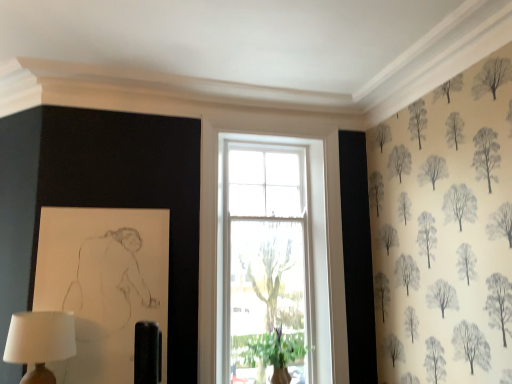
Question: From a real-world perspective, is matte white lampshade at lower left on green leafy plant at window?

Choices:
 (A) yes
 (B) no

Answer: (A)

Question: Is matte white lampshade at lower left smaller than green leafy plant at window?

Choices:
 (A) yes
 (B) no

Answer: (A)

Question: Is matte white lampshade at lower left positioned far away from green leafy plant at window?

Choices:
 (A) yes
 (B) no

Answer: (A)

Question: Is matte white lampshade at lower left further to the viewer compared to green leafy plant at window?

Choices:
 (A) yes
 (B) no

Answer: (B)

Question: Is matte white lampshade at lower left looking in the opposite direction of green leafy plant at window?

Choices:
 (A) yes
 (B) no

Answer: (B)

Question: Is matte white lampshade at lower left shorter than green leafy plant at window?

Choices:
 (A) yes
 (B) no

Answer: (A)

Question: Is green leafy plant at window directly adjacent to matte white lampshade at lower left?

Choices:
 (A) no
 (B) yes

Answer: (A)

Question: From the image's perspective, is green leafy plant at window located beneath matte white lampshade at lower left?

Choices:
 (A) no
 (B) yes

Answer: (B)

Question: Does green leafy plant at window have a lesser height compared to matte white lampshade at lower left?

Choices:
 (A) yes
 (B) no

Answer: (B)

Question: From the image's perspective, is green leafy plant at window located above matte white lampshade at lower left?

Choices:
 (A) yes
 (B) no

Answer: (B)

Question: Considering the relative sizes of green leafy plant at window and matte white lampshade at lower left in the image provided, is green leafy plant at window thinner than matte white lampshade at lower left?

Choices:
 (A) no
 (B) yes

Answer: (A)

Question: Can you confirm if green leafy plant at window is positioned to the right of matte white lampshade at lower left?

Choices:
 (A) no
 (B) yes

Answer: (B)

Question: Considering the positions of point [x=303, y=344] and point [x=36, y=367], is point [x=303, y=344] closer or farther from the camera than point [x=36, y=367]?

Choices:
 (A) closer
 (B) farther

Answer: (B)